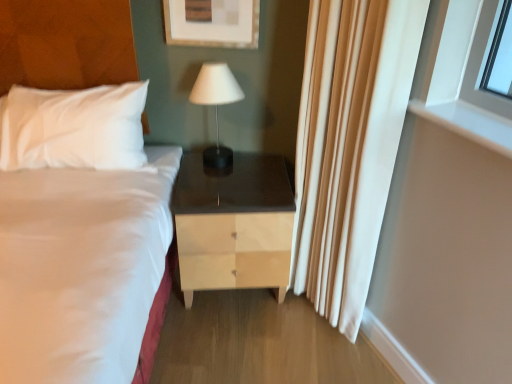
Question: Is light wood/finish nightstand at center at the left side of white silky curtain at right?

Choices:
 (A) yes
 (B) no

Answer: (A)

Question: From the image's perspective, is light wood/finish nightstand at center on white silky curtain at right?

Choices:
 (A) no
 (B) yes

Answer: (A)

Question: Does light wood/finish nightstand at center have a smaller size compared to white silky curtain at right?

Choices:
 (A) yes
 (B) no

Answer: (A)

Question: From a real-world perspective, is light wood/finish nightstand at center below white silky curtain at right?

Choices:
 (A) yes
 (B) no

Answer: (A)

Question: Can you confirm if light wood/finish nightstand at center is taller than white silky curtain at right?

Choices:
 (A) no
 (B) yes

Answer: (A)

Question: Are light wood/finish nightstand at center and white silky curtain at right far apart?

Choices:
 (A) yes
 (B) no

Answer: (B)

Question: Is light wood/finish nightstand at center facing towards white glossy window at upper right?

Choices:
 (A) no
 (B) yes

Answer: (A)

Question: Is there a large distance between light wood/finish nightstand at center and white glossy window at upper right?

Choices:
 (A) yes
 (B) no

Answer: (B)

Question: Is light wood/finish nightstand at center at the right side of white glossy window at upper right?

Choices:
 (A) yes
 (B) no

Answer: (B)

Question: Considering the relative sizes of light wood/finish nightstand at center and white glossy window at upper right in the image provided, is light wood/finish nightstand at center wider than white glossy window at upper right?

Choices:
 (A) no
 (B) yes

Answer: (B)

Question: Is white glossy window at upper right a part of light wood/finish nightstand at center?

Choices:
 (A) no
 (B) yes

Answer: (A)

Question: From the image's perspective, is light wood/finish nightstand at center under white glossy window at upper right?

Choices:
 (A) no
 (B) yes

Answer: (B)

Question: Does white silky curtain at right contain white glossy window at upper right?

Choices:
 (A) yes
 (B) no

Answer: (B)